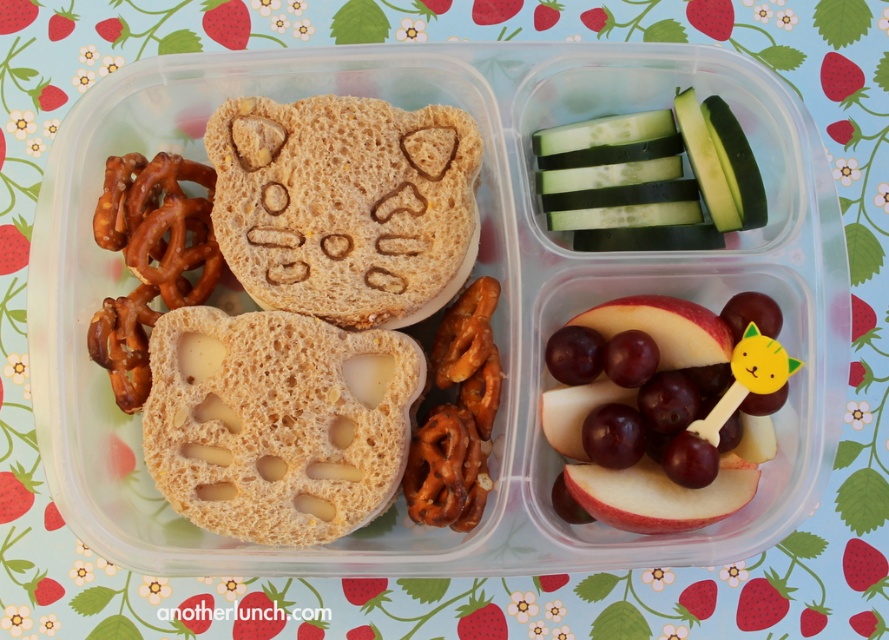
Can you confirm if peanut butter sandwich at left is bigger than brown crunchy pretzel at left?

Indeed, peanut butter sandwich at left has a larger size compared to brown crunchy pretzel at left.

Who is positioned more to the left, peanut butter sandwich at left or brown crunchy pretzel at left?

brown crunchy pretzel at left is more to the left.

Does point (319, 192) come farther from viewer compared to point (133, 330)?

Yes, point (319, 192) is farther from viewer.

Locate an element on the screen. The image size is (889, 640). peanut butter sandwich at left is located at coordinates (310, 314).

Is point (405, 189) farther from camera compared to point (562, 371)?

Yes, it is behind point (562, 371).

Where is `peanut butter sandwich at left`? The width and height of the screenshot is (889, 640). peanut butter sandwich at left is located at coordinates (310, 314).

Between point (388, 268) and point (770, 385), which one is positioned behind?

Positioned behind is point (388, 268).

The height and width of the screenshot is (640, 889). Find the location of `peanut butter sandwich at left`. peanut butter sandwich at left is located at coordinates (310, 314).

Is point (679, 445) positioned before point (165, 168)?

Yes, point (679, 445) is closer to viewer.

Which of these two, red matte apple at center or brown crunchy pretzel at left, stands shorter?

Standing shorter between the two is red matte apple at center.

Does point (631, 476) come behind point (119, 349)?

No, (631, 476) is in front of (119, 349).

Where is `red matte apple at center`? This screenshot has height=640, width=889. red matte apple at center is located at coordinates (663, 408).